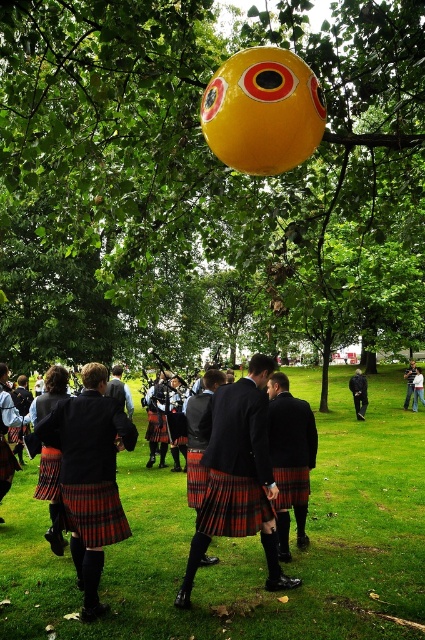
You are a photographer trying to capture a clear shot of the red plaid kilt at center and the black leather jacket at center. Based on their sizes, which one should you focus on first to ensure both fit in the frame?

The red plaid kilt at center might be wider than black leather jacket at center, so focusing on the red plaid kilt at center first would ensure both fit in the frame.

You are a photographer standing at the center of the park. You want to take a photo of the red plaid kilt at center and the black leather jacket at center. If your camera has a maximum focus range of 15 meters, will both subjects be in focus?

The red plaid kilt at center is 16.44 meters away from the black leather jacket at center. Since the camera can only focus up to 15 meters, the distance between them exceeds the focus range. Therefore, both subjects cannot be in focus simultaneously.